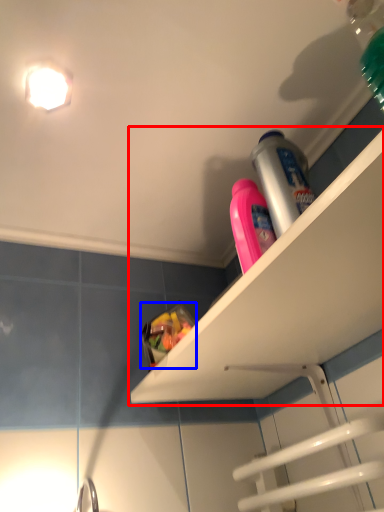
Question: Which point is closer to the camera, shelf (highlighted by a red box) or food (highlighted by a blue box)?

Choices:
 (A) shelf
 (B) food

Answer: (A)